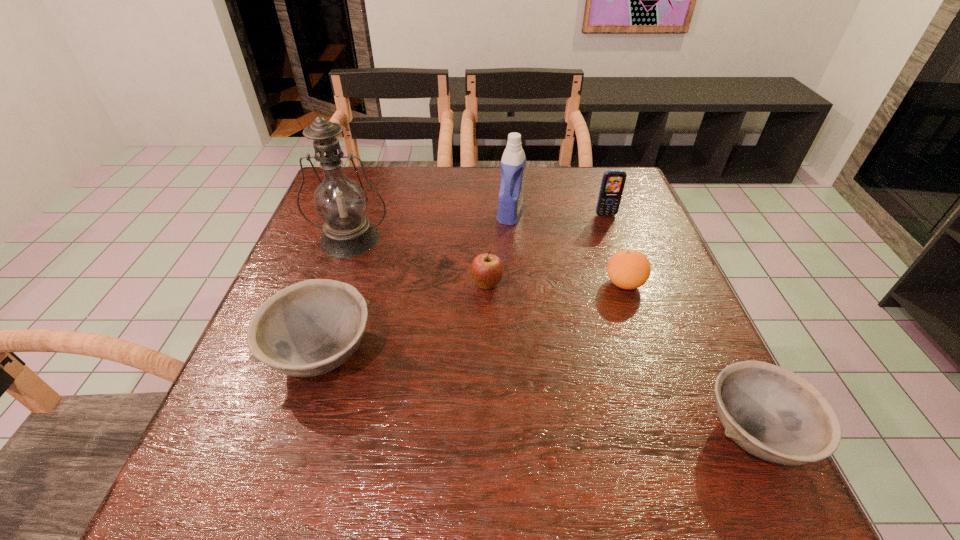
The width and height of the screenshot is (960, 540). Find the location of `the taller bowl`. the taller bowl is located at coordinates coord(310,328).

At what (x,y) coordinates should I click in order to perform the action: click on the right bowl. Please return your answer as a coordinate pair (x, y). Image resolution: width=960 pixels, height=540 pixels. Looking at the image, I should click on (772, 413).

I want to click on oil lamp, so click(x=340, y=202).

Image resolution: width=960 pixels, height=540 pixels. What are the coordinates of `the sixth shortest object` in the screenshot? It's located at (513, 163).

Where is `the fifth shortest object`? the fifth shortest object is located at coordinates (613, 181).

The image size is (960, 540). In order to click on orange in this screenshot , I will do `click(628, 269)`.

Identify the location of apple. pos(487,270).

Locate an element on the screen. This screenshot has width=960, height=540. vacant space located on the right of the left bowl is located at coordinates coord(540,355).

Find the location of a particular element. Image resolution: width=960 pixels, height=540 pixels. free location located on the left of the shorter bowl is located at coordinates (540, 433).

Locate an element on the screen. free space located 0.200m on the right of the oil lamp is located at coordinates (470, 239).